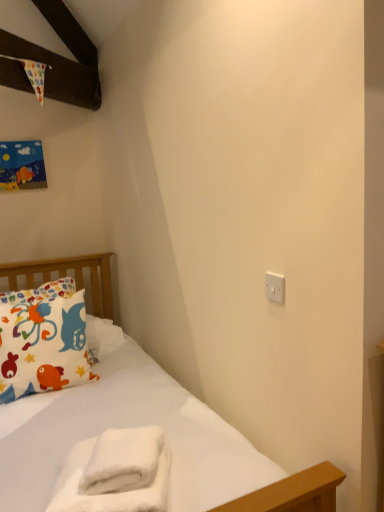
Question: Is printed fabric pillow at left in front of or behind white plastic switch at upper right in the image?

Choices:
 (A) behind
 (B) front

Answer: (A)

Question: From the image's perspective, relative to white plastic switch at upper right, is printed fabric pillow at left above or below?

Choices:
 (A) above
 (B) below

Answer: (B)

Question: Which is farther from the white fluffy towel at lower center?

Choices:
 (A) printed fabric pillow at left
 (B) white plastic switch at upper right

Answer: (A)

Question: Which is nearer to the white fluffy towel at lower center?

Choices:
 (A) printed fabric pillow at left
 (B) white plastic switch at upper right

Answer: (B)